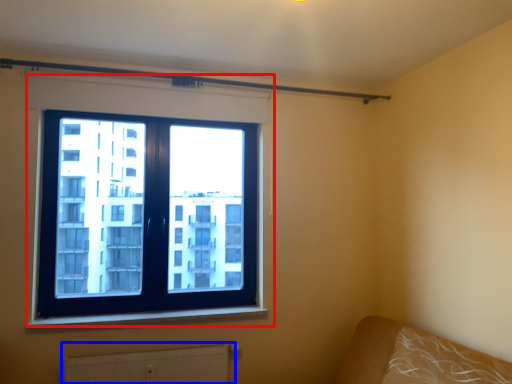
Question: Which object is closer to the camera taking this photo, window (highlighted by a red box) or radiator (highlighted by a blue box)?

Choices:
 (A) window
 (B) radiator

Answer: (B)